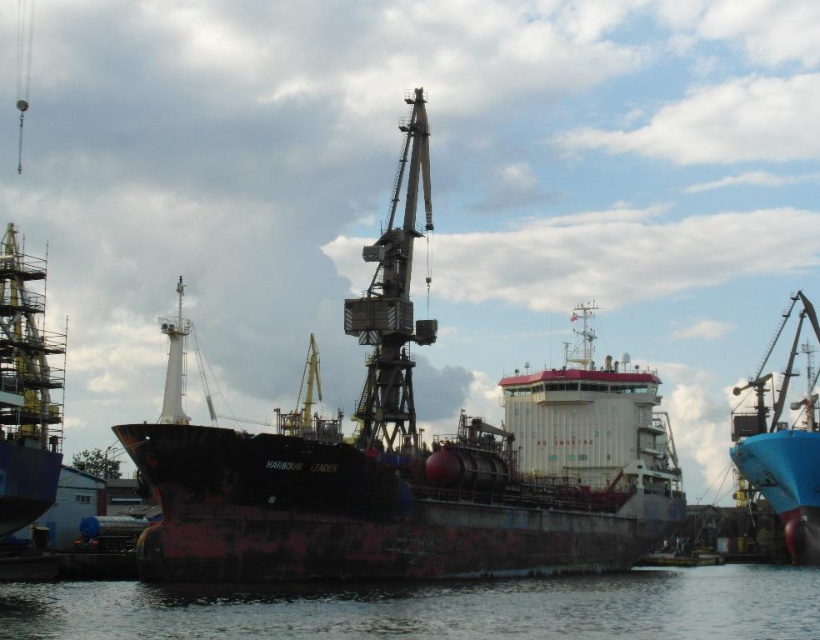
You are an engineer inspecting the dry dock. You need to know if the clear water at lower center can accommodate the blue matte boat at right in terms of width. Based on the scene, can it fit?

The clear water at lower center is wider than the blue matte boat at right, so the boat can fit within the water area.

You are standing at the point marked as point (x=438, y=609) in the harbor scene. Looking around, you notice clear water at lower center. What is directly beneath your feet?

The clear water at lower center is directly beneath point (x=438, y=609), so standing at that point would have you standing in the clear water at lower center.

You are a harbor inspector standing at the camera position. You need to inspect the rusty metal ship at center. Given that your inspection equipment has a maximum effective range of 100 meters, can you effectively inspect the ship from your current position?

The rusty metal ship at center is 111.91 meters from camera, which exceeds the equipment range of 100 meters. Therefore, you cannot effectively inspect the ship from your current position.